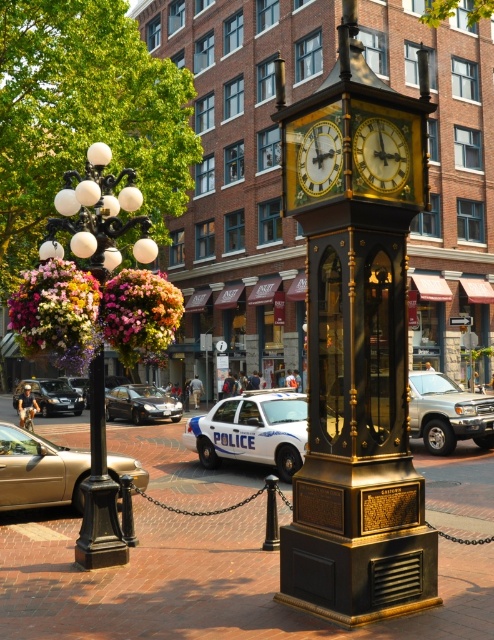
You are a tourist standing in front of the historic clock tower. You notice a gold polished metal clock at center and a white glossy police car at center. Which object is positioned to the right of the other?

The gold polished metal clock at center is to the right of the white glossy police car at center.